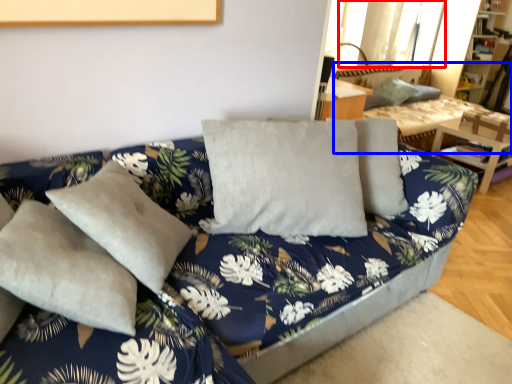
Question: Which of the following is the closest to the observer, window (highlighted by a red box) or couch (highlighted by a blue box)?

Choices:
 (A) window
 (B) couch

Answer: (B)